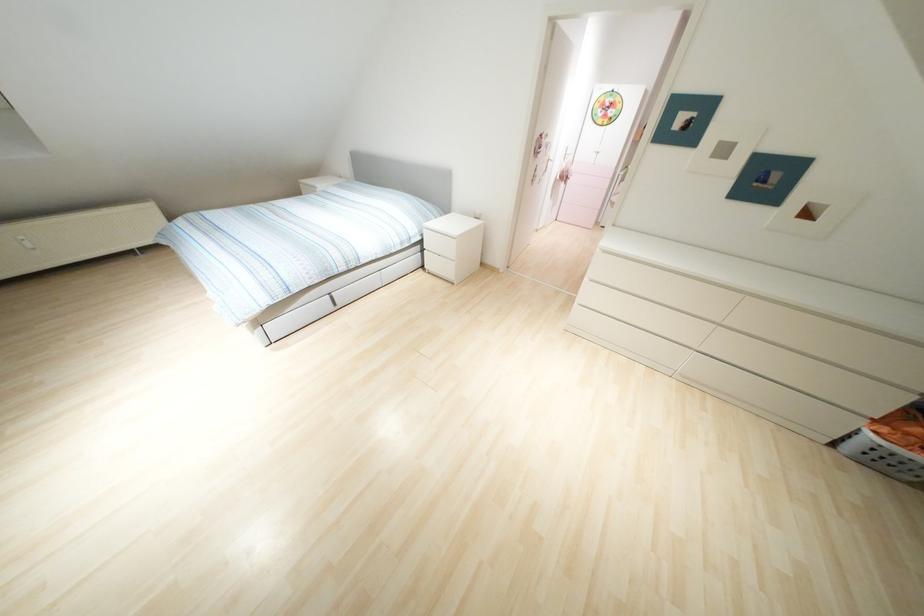
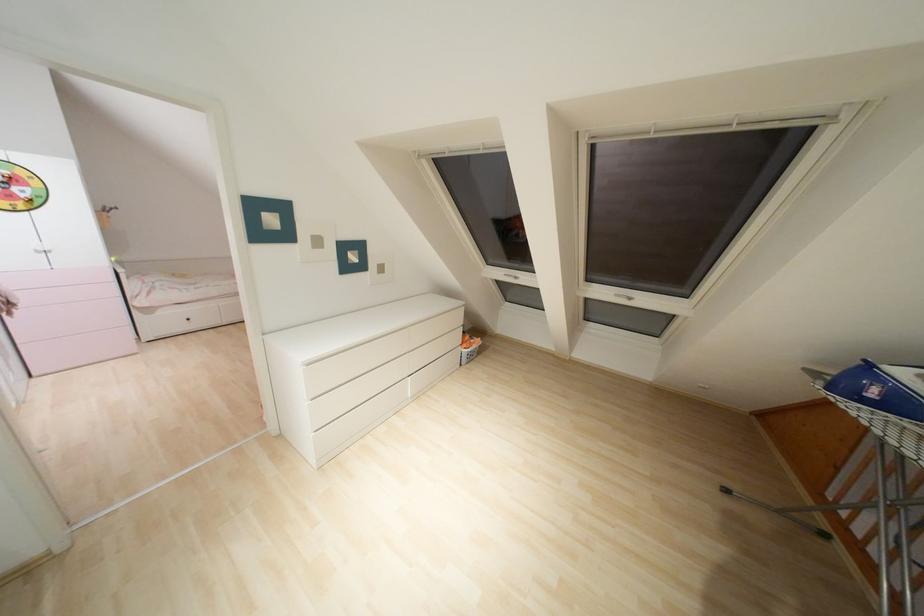
The first image is from the beginning of the video and the second image is from the end. How did the camera likely rotate when shooting the video?

The camera's rotation is toward right-down.